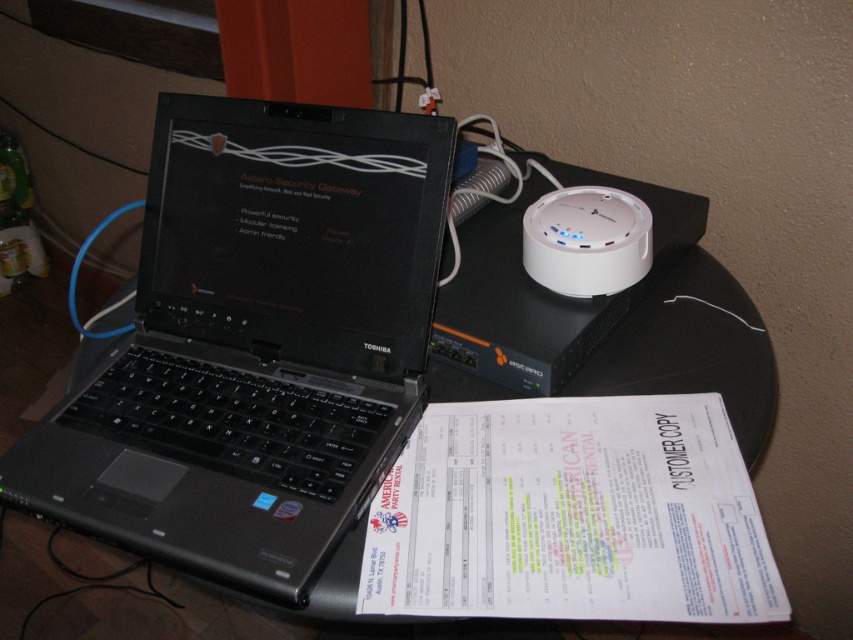
You are setting up a home office and need to place a new monitor between the black plastic laptop at center and the white plastic device at upper right. Based on their positions, where should you position the monitor?

The black plastic laptop at center is located below the white plastic device at upper right, so you should place the monitor between them vertically, positioning it either above the laptop or below the white device depending on desired screen orientation.